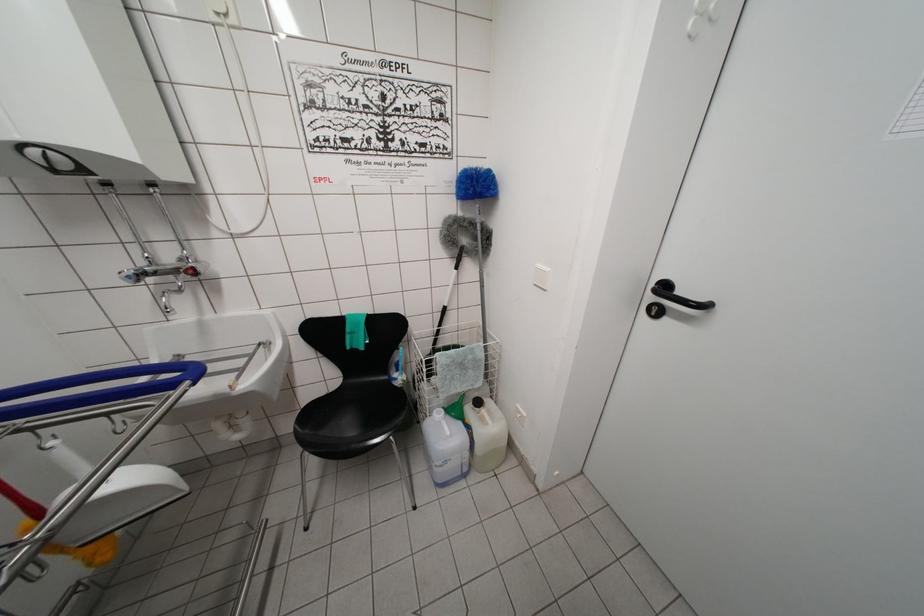
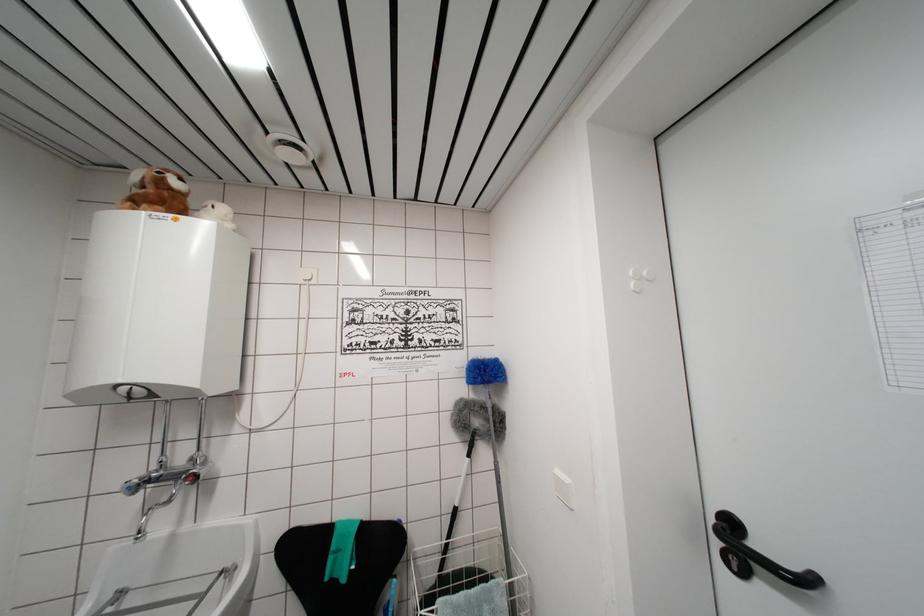
Where in the second image is the point corresponding to point (131, 282) from the first image?

(132, 493)